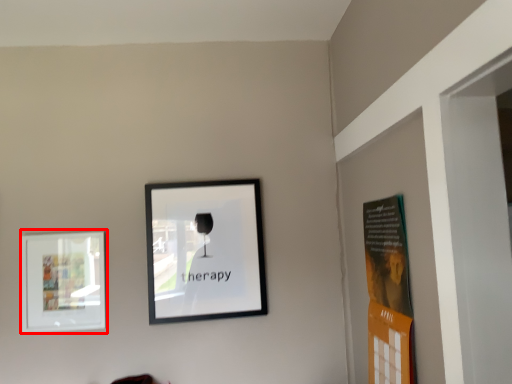
Question: From the image's perspective, considering the relative positions of picture frame (annotated by the red box) and picture frame in the image provided, where is picture frame (annotated by the red box) located with respect to the staircase?

Choices:
 (A) below
 (B) above

Answer: (A)